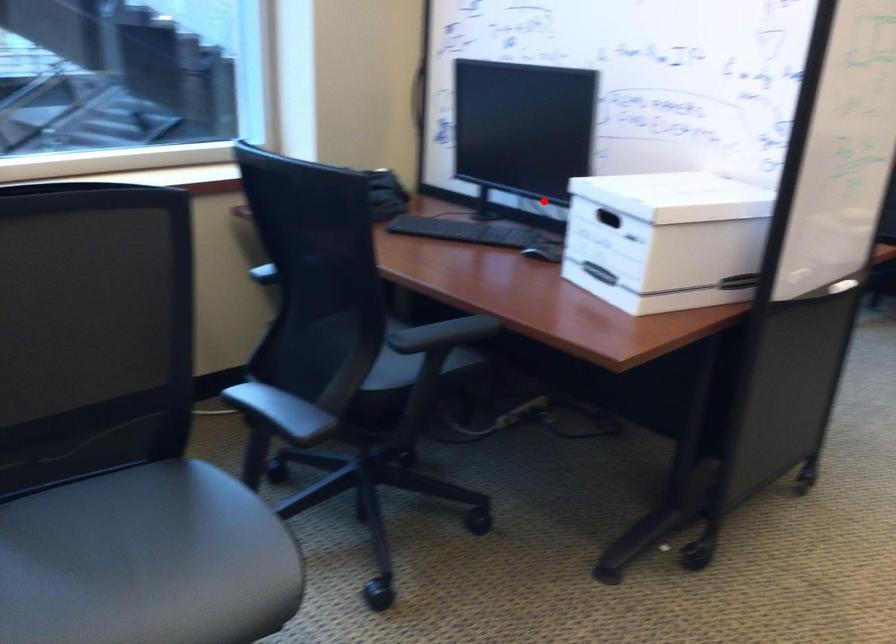
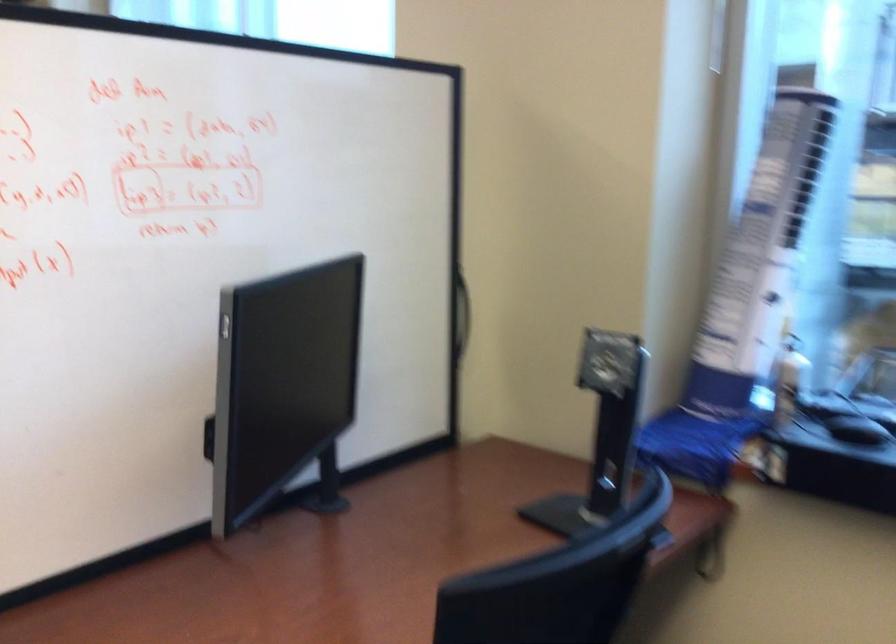
Question: I am providing you with two images of the same scene from different viewpoints. A red point is shown in image1. For the corresponding object point in image2, is it positioned nearer or farther from the camera?

Choices:
 (A) Nearer
 (B) Farther

Answer: (A)